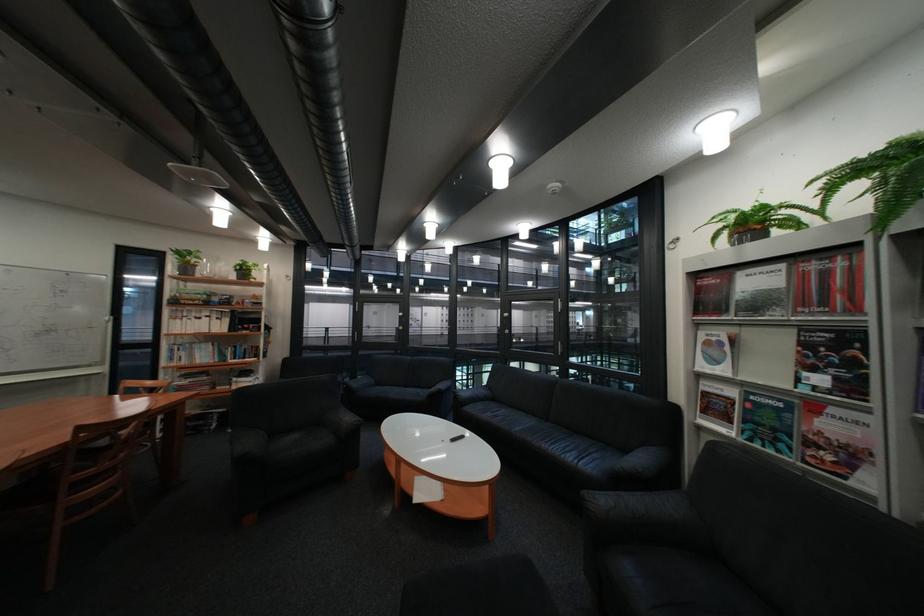
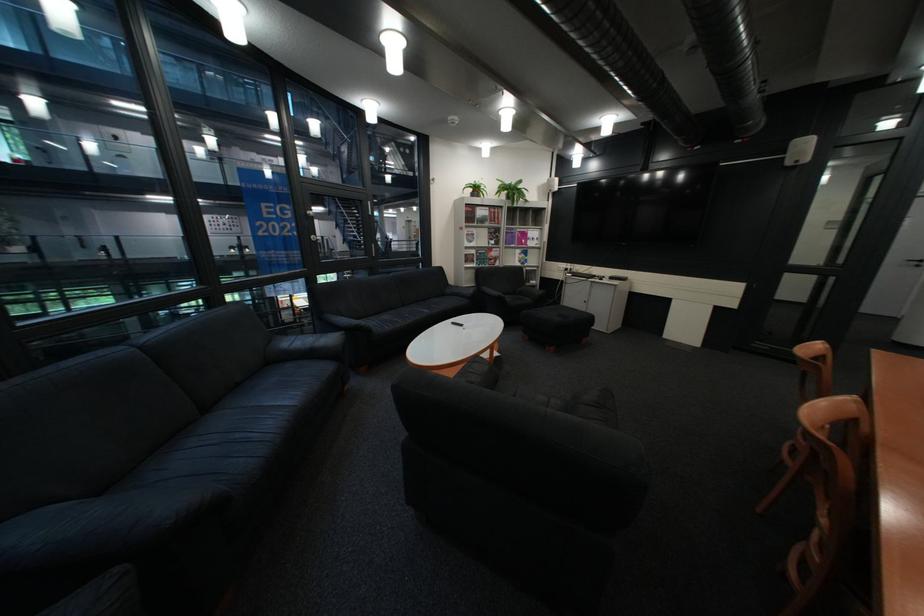
Find the pixel in the second image that matches the point at 704,274 in the first image.

(481, 205)